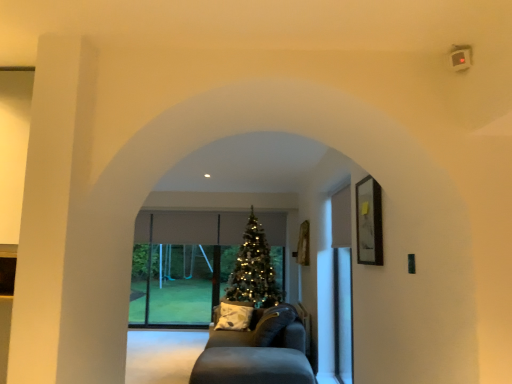
What do you see at coordinates (172, 285) in the screenshot? This screenshot has height=384, width=512. I see `transparent glass door at center` at bounding box center [172, 285].

Identify the location of dark gray fabric couch at center. Image resolution: width=512 pixels, height=384 pixels. (257, 352).

Identify the location of shiny gold christmas tree at center. (254, 269).

Looking at this image, from a real-world perspective, which object rests below the other?

dark gray fabric couch at center is physically lower.

Is transparent glass door at center placed right next to dark gray fabric couch at center?

No, transparent glass door at center is not with dark gray fabric couch at center.

Consider the image. Can you tell me how much transparent glass door at center and dark gray fabric couch at center differ in facing direction?

transparent glass door at center and dark gray fabric couch at center are facing 90 degrees away from each other.

From the image's perspective, between transparent glass door at center and dark gray fabric couch at center, who is located below?

dark gray fabric couch at center, from the image's perspective.

Considering the relative sizes of wooden framed picture at right and dark gray fabric couch at center in the image provided, is wooden framed picture at right smaller than dark gray fabric couch at center?

Indeed, wooden framed picture at right has a smaller size compared to dark gray fabric couch at center.

Is point (366, 233) in front of point (275, 349)?

Yes, it is in front of point (275, 349).

Is wooden framed picture at right at the right side of dark gray fabric couch at center?

Yes, wooden framed picture at right is to the right of dark gray fabric couch at center.

Consider the image. Can you confirm if wooden framed picture at right is wider than dark gray fabric couch at center?

No.

Is transparent glass door at center far away from transparent glass screen door at right?

Yes.

How far apart are transparent glass door at center and transparent glass screen door at right?

transparent glass door at center and transparent glass screen door at right are 3.12 meters apart.

Does transparent glass door at center come behind transparent glass screen door at right?

That is True.

Looking at their sizes, would you say transparent glass door at center is wider or thinner than transparent glass screen door at right?

In the image, transparent glass door at center appears to be wider than transparent glass screen door at right.

Is shiny gold christmas tree at center further to camera compared to transparent glass screen door at right?

That is True.

Does point (268, 249) come behind point (339, 372)?

Yes, it is.

Which is more to the right, shiny gold christmas tree at center or transparent glass screen door at right?

transparent glass screen door at right.

You are a GUI agent. You are given a task and a screenshot of the screen. Output one action in this format:
    pyautogui.click(x=<x>, y=<y>)
    Task: Click on the christmas tree that is above the dark gray fabric couch at center (from a real-world perspective)
    
    Given the screenshot: What is the action you would take?
    pyautogui.click(x=254, y=269)

Can you confirm if shiny gold christmas tree at center is positioned to the right of dark gray fabric couch at center?

In fact, shiny gold christmas tree at center is to the left of dark gray fabric couch at center.

Considering the relative sizes of shiny gold christmas tree at center and dark gray fabric couch at center in the image provided, is shiny gold christmas tree at center bigger than dark gray fabric couch at center?

Correct, shiny gold christmas tree at center is larger in size than dark gray fabric couch at center.

From a real-world perspective, is shiny gold christmas tree at center on top of dark gray fabric couch at center?

Yes, from a real-world perspective, shiny gold christmas tree at center is on top of dark gray fabric couch at center.

In the image, is dark gray fabric couch at center positioned in front of or behind transparent glass door at center?

Visually, dark gray fabric couch at center is located in front of transparent glass door at center.

Which of these two, dark gray fabric couch at center or transparent glass door at center, stands shorter?

dark gray fabric couch at center.

From the image's perspective, between dark gray fabric couch at center and transparent glass door at center, which one is located above?

From the image's view, transparent glass door at center is above.

What are the coordinates of `screen door that appears above the dark gray fabric couch at center (from a real-world perspective)` in the screenshot? It's located at (343, 315).

From a real-world perspective, who is located higher, transparent glass screen door at right or dark gray fabric couch at center?

transparent glass screen door at right, from a real-world perspective.

Between transparent glass screen door at right and dark gray fabric couch at center, which one has more height?

transparent glass screen door at right.

Measure the distance from transparent glass screen door at right to dark gray fabric couch at center.

A distance of 90.26 centimeters exists between transparent glass screen door at right and dark gray fabric couch at center.

Where is `glass door located behind the dark gray fabric couch at center`? glass door located behind the dark gray fabric couch at center is located at coordinates (172, 285).

You are a GUI agent. You are given a task and a screenshot of the screen. Output one action in this format:
    pyautogui.click(x=<x>, y=<y>)
    Task: Click on the picture frame lying above the dark gray fabric couch at center (from the image's perspective)
    Image resolution: width=512 pixels, height=384 pixels.
    Given the screenshot: What is the action you would take?
    pyautogui.click(x=369, y=222)

Looking at the image, which one is located closer to transparent glass screen door at right, transparent glass door at center or shiny gold christmas tree at center?

Based on the image, shiny gold christmas tree at center appears to be nearer to transparent glass screen door at right.

Considering their positions, is transparent glass door at center positioned closer to wooden framed picture at right than dark gray fabric couch at center?

dark gray fabric couch at center is closer to wooden framed picture at right.

In the scene shown: Which object lies nearer to the anchor point wooden framed picture at right, transparent glass screen door at right or transparent glass door at center?

transparent glass screen door at right is closer to wooden framed picture at right.

Based on their spatial positions, is dark gray fabric couch at center or transparent glass door at center closer to wooden framed picture at right?

The object closer to wooden framed picture at right is dark gray fabric couch at center.

From the image, which object appears to be farther from transparent glass screen door at right, wooden framed picture at right or transparent glass door at center?

The object further to transparent glass screen door at right is transparent glass door at center.

Looking at the image, which one is located closer to transparent glass door at center, wooden framed picture at right or dark gray fabric couch at center?

Among the two, dark gray fabric couch at center is located nearer to transparent glass door at center.

Based on their spatial positions, is dark gray fabric couch at center or shiny gold christmas tree at center further from transparent glass screen door at right?

shiny gold christmas tree at center is further to transparent glass screen door at right.

Which object lies nearer to the anchor point shiny gold christmas tree at center, transparent glass screen door at right or dark gray fabric couch at center?

dark gray fabric couch at center is closer to shiny gold christmas tree at center.

I want to click on studio couch located between wooden framed picture at right and shiny gold christmas tree at center in the depth direction, so click(257, 352).

The height and width of the screenshot is (384, 512). Identify the location of christmas tree between transparent glass screen door at right and transparent glass door at center in the front-back direction. (254, 269).

Where is `screen door between wooden framed picture at right and shiny gold christmas tree at center in the front-back direction`? screen door between wooden framed picture at right and shiny gold christmas tree at center in the front-back direction is located at coordinates (343, 315).

Locate an element on the screen. This screenshot has height=384, width=512. studio couch between wooden framed picture at right and transparent glass door at center along the z-axis is located at coordinates (257, 352).